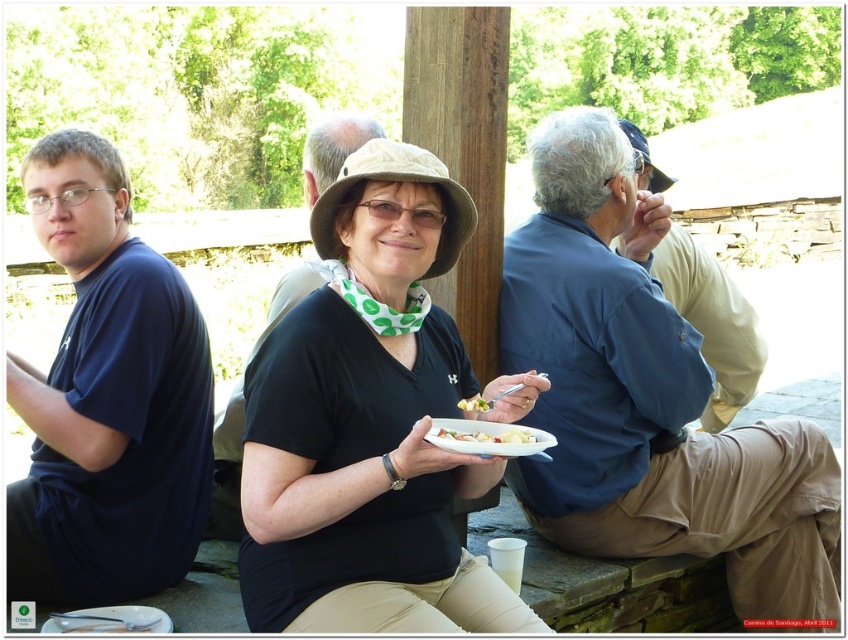
This screenshot has height=640, width=848. What do you see at coordinates (107, 397) in the screenshot? I see `dark blue t-shirt at left` at bounding box center [107, 397].

Locate an element on the screen. This screenshot has height=640, width=848. dark blue t-shirt at left is located at coordinates (107, 397).

Does white creamy pasta at center have a lesser height compared to yellow matte food at center?

Yes.

Between point (495, 433) and point (476, 412), which one is positioned in front?

Point (495, 433)

Does point (495, 436) come in front of point (466, 403)?

Yes, point (495, 436) is closer to viewer.

Locate an element on the screen. white creamy pasta at center is located at coordinates (487, 435).

Is white matte plate at center further to the viewer compared to yellow matte food at center?

That is False.

Which is behind, point (497, 433) or point (487, 406)?

Positioned behind is point (487, 406).

This screenshot has height=640, width=848. I want to click on white matte plate at center, so click(x=488, y=438).